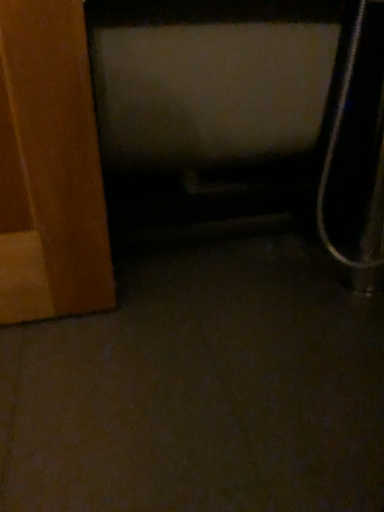
This screenshot has width=384, height=512. In order to click on matte white pillow at center in this screenshot , I will do `click(250, 109)`.

Image resolution: width=384 pixels, height=512 pixels. Describe the element at coordinates (250, 109) in the screenshot. I see `matte white pillow at center` at that location.

The image size is (384, 512). In order to click on matte white pillow at center in this screenshot , I will do click(x=250, y=109).